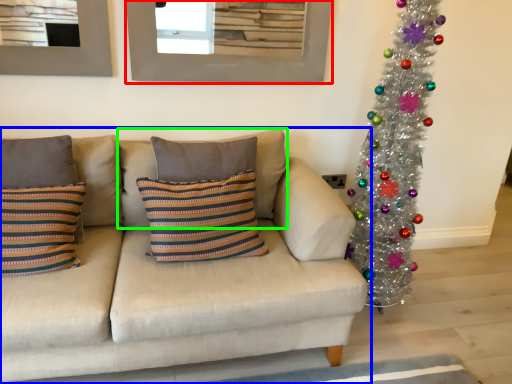
Question: Considering the real-world distances, which object is farthest from picture frame (highlighted by a red box)? studio couch (highlighted by a blue box) or pillow (highlighted by a green box)?

Choices:
 (A) studio couch
 (B) pillow

Answer: (A)